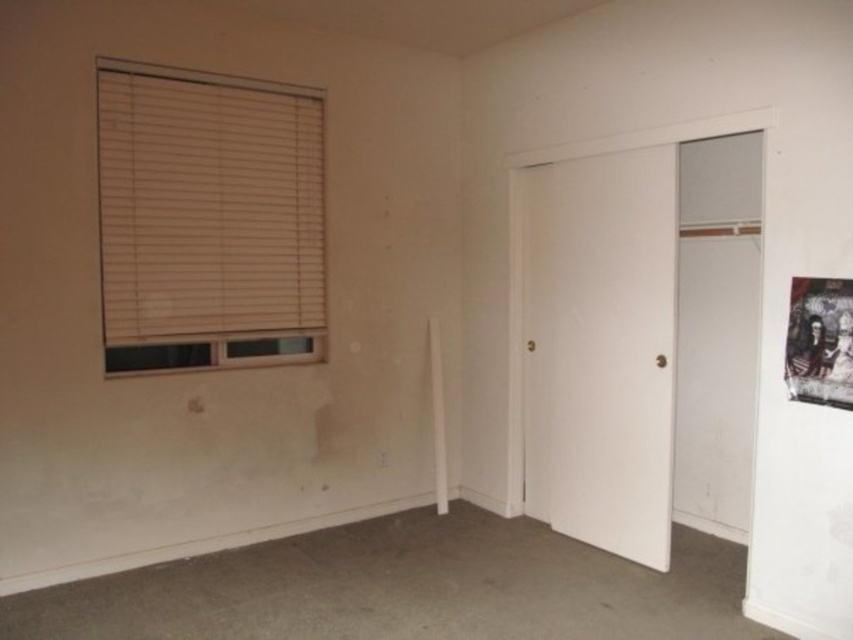
Between point (190, 316) and point (809, 342), which one is positioned behind?

The point (190, 316) is more distant.

Which is in front, point (212, 100) or point (804, 339)?

Positioned in front is point (804, 339).

Where is `beige wood blinds at upper left`? beige wood blinds at upper left is located at coordinates (207, 220).